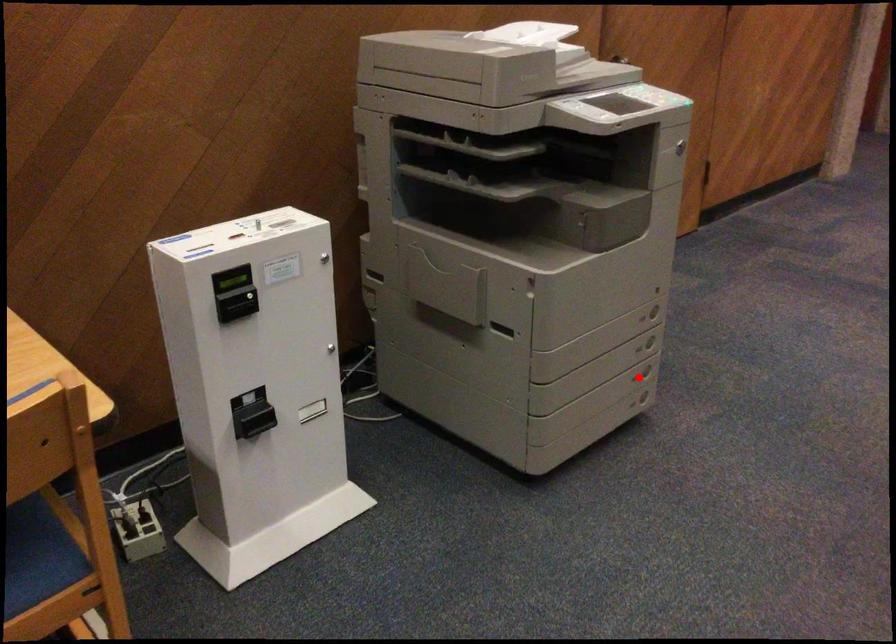
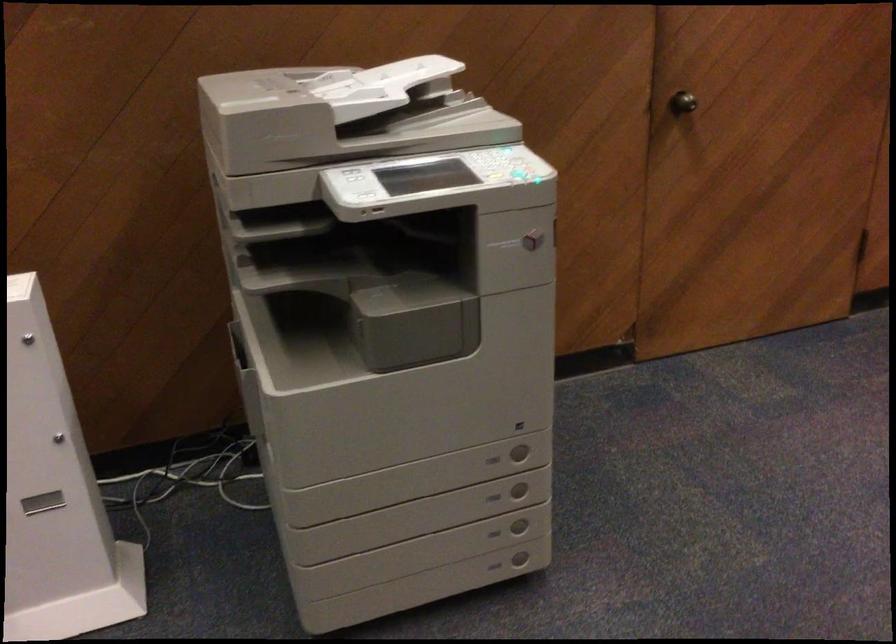
Where in the second image is the point corresponding to the highlighted location from the first image?

(494, 533)